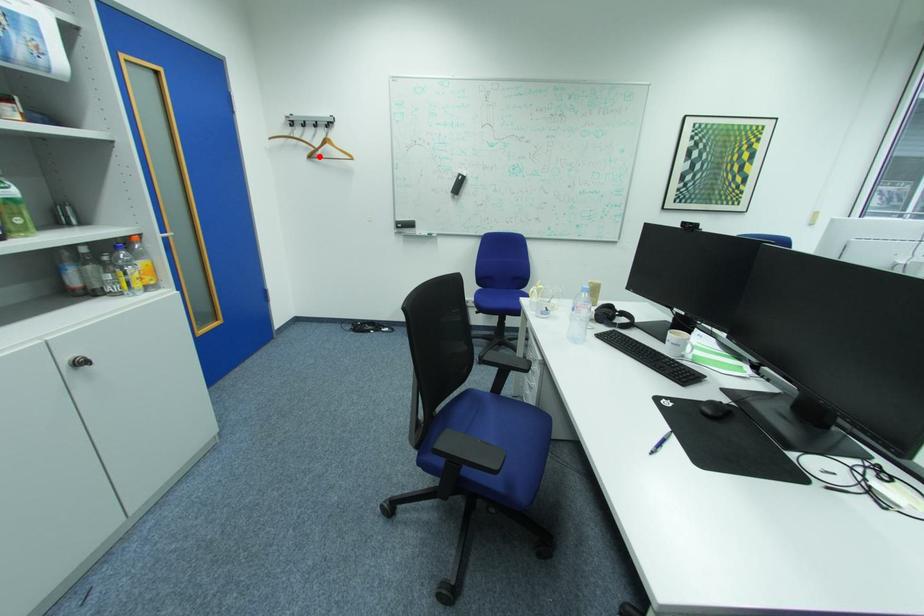
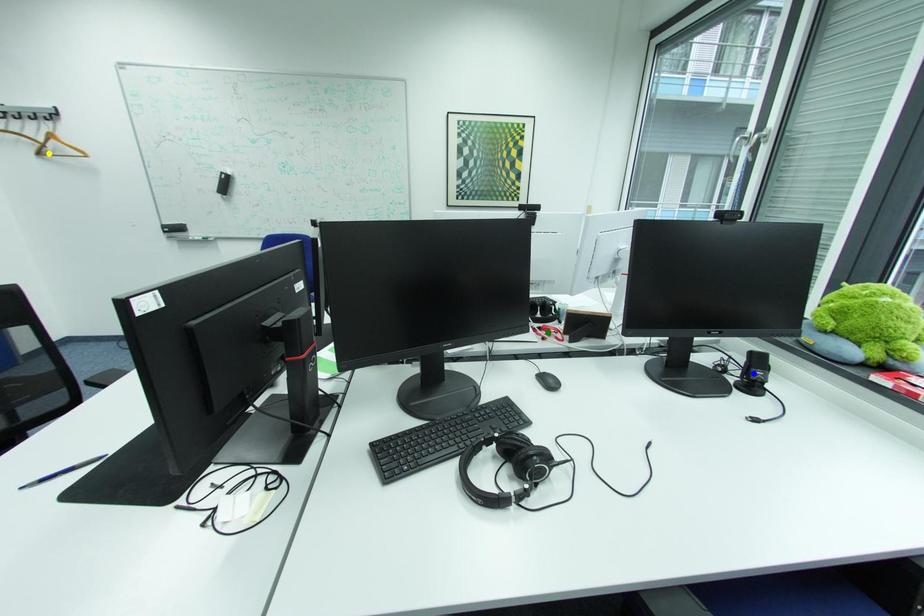
Question: I am providing you with two images of the same scene from different viewpoints. A red point is marked on the first image. You are given multiple points on the second image. Which point in image 2 is actually the same real-world point as the red point in image 1?

Choices:
 (A) green point
 (B) yellow point
 (C) blue point

Answer: (B)